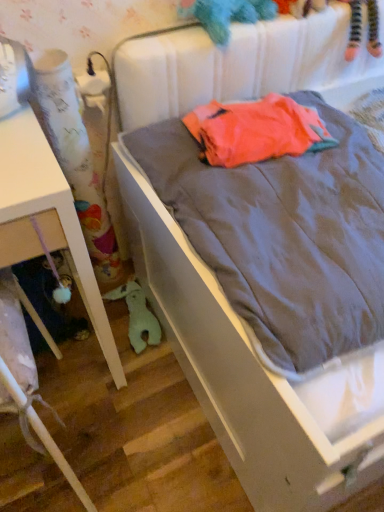
You are a GUI agent. You are given a task and a screenshot of the screen. Output one action in this format:
    pyautogui.click(x=<x>, y=<y>)
    Task: Click on the empty space that is ontop of green plush toy at lower left, the second toy in the right-to-left sequence (from a real-world perspective)
    The height and width of the screenshot is (512, 384).
    Given the screenshot: What is the action you would take?
    pyautogui.click(x=129, y=304)